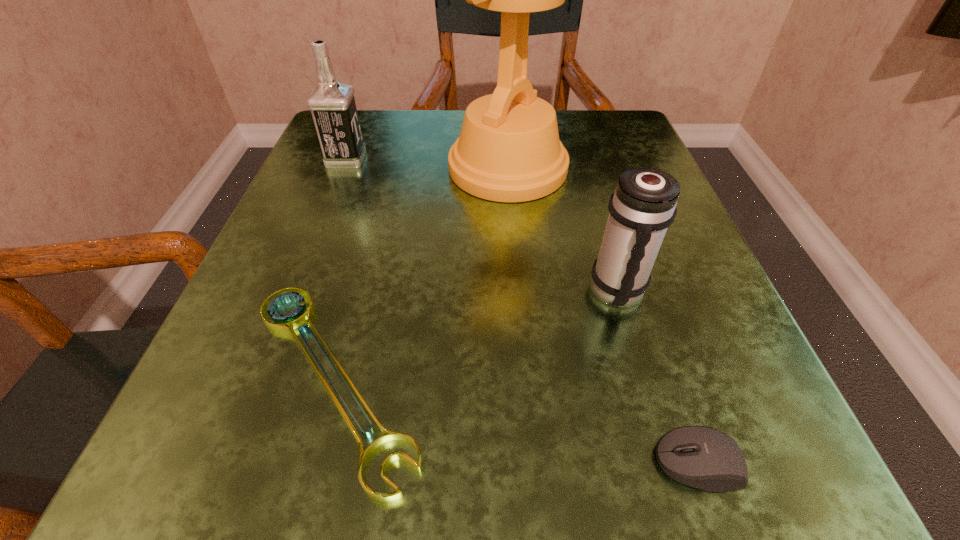
You are a GUI agent. You are given a task and a screenshot of the screen. Output one action in this format:
    pyautogui.click(x=<x>, y=<y>)
    Task: Click on the tallest object
    The width and height of the screenshot is (960, 540).
    Given the screenshot: What is the action you would take?
    pyautogui.click(x=508, y=150)

The width and height of the screenshot is (960, 540). In order to click on the second tallest object in this screenshot , I will do `click(332, 103)`.

Locate an element on the screen. The height and width of the screenshot is (540, 960). thermos bottle is located at coordinates (643, 206).

This screenshot has width=960, height=540. I want to click on the fourth tallest object, so click(702, 457).

Find the location of `wrench`. wrench is located at coordinates (286, 323).

This screenshot has width=960, height=540. Identify the location of vacant space situated 0.100m on the right of the tallest object. (620, 168).

Find the location of `blank area located 0.320m on the front label of the second tallest object`. blank area located 0.320m on the front label of the second tallest object is located at coordinates tap(530, 159).

The width and height of the screenshot is (960, 540). In order to click on free spot located 0.240m on the side with the handle of the third shortest object in this screenshot , I will do `click(684, 517)`.

You are a GUI agent. You are given a task and a screenshot of the screen. Output one action in this format:
    pyautogui.click(x=<x>, y=<y>)
    Task: Click on the vacant area situated on the left of the computer equipment
    The height and width of the screenshot is (540, 960).
    Given the screenshot: What is the action you would take?
    pyautogui.click(x=498, y=463)

Find the location of a particular element. Image resolution: width=960 pixels, height=540 pixels. free location located 0.240m on the back of the shortest object is located at coordinates (382, 192).